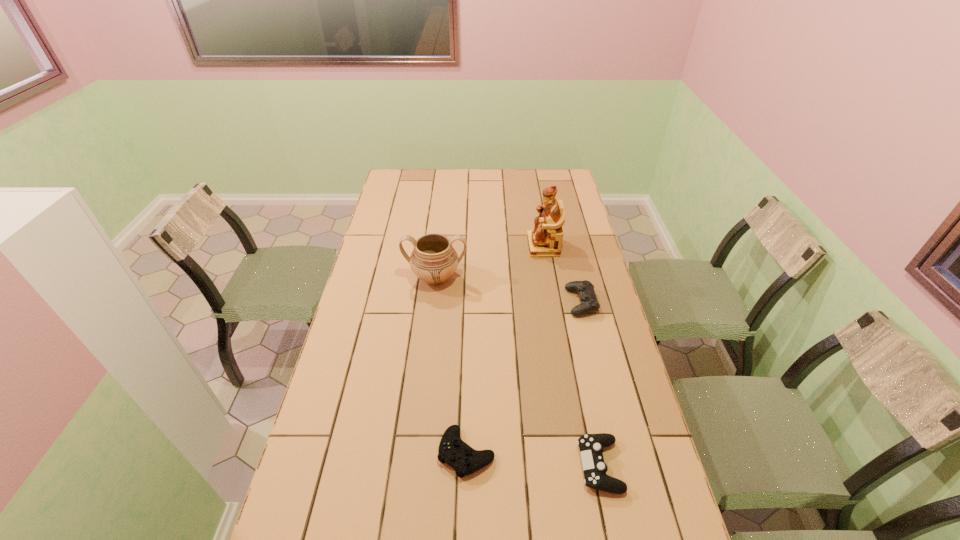
Locate an element on the screen. The image size is (960, 540). free space located on the back of the farthest control is located at coordinates (575, 278).

You are a GUI agent. You are given a task and a screenshot of the screen. Output one action in this format:
    pyautogui.click(x=<x>, y=<y>)
    Task: Click on the vacant region located on the back of the shortest control
    The image size is (960, 540).
    Given the screenshot: What is the action you would take?
    pyautogui.click(x=468, y=360)

Find the location of a particular element. The height and width of the screenshot is (540, 960). figurine that is at the right edge is located at coordinates (545, 240).

This screenshot has height=540, width=960. In the image, there is a desktop. Identify the location of vacant region at the far edge. (524, 188).

Where is `vacant space at the left edge of the desktop`? The height and width of the screenshot is (540, 960). vacant space at the left edge of the desktop is located at coordinates (307, 485).

Image resolution: width=960 pixels, height=540 pixels. I want to click on free point at the right edge, so click(x=651, y=448).

The image size is (960, 540). Identify the location of vacant space at the far right corner of the desktop. (561, 171).

Where is `free space that is in between the leftmost control and the farthest control`? The width and height of the screenshot is (960, 540). free space that is in between the leftmost control and the farthest control is located at coordinates (524, 377).

This screenshot has height=540, width=960. Find the location of `free space that is in between the farthest control and the leftmost control`. free space that is in between the farthest control and the leftmost control is located at coordinates (524, 377).

Identify the location of free area in between the farthest object and the shortest object. (505, 349).